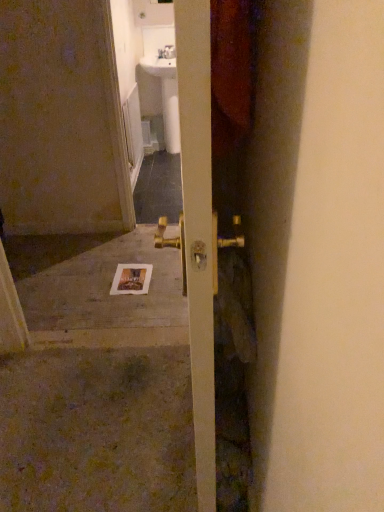
Where is `free space above white paper postcard at center (from a real-world perspective)`? The image size is (384, 512). free space above white paper postcard at center (from a real-world perspective) is located at coordinates (131, 278).